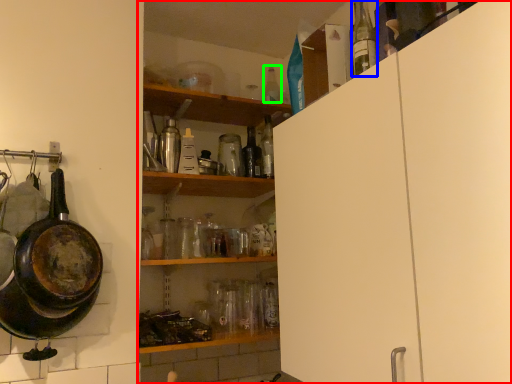
Question: Considering the real-world distances, which object is farthest from shelf (highlighted by a red box)? bottle (highlighted by a blue box) or bottle (highlighted by a green box)?

Choices:
 (A) bottle
 (B) bottle

Answer: (B)